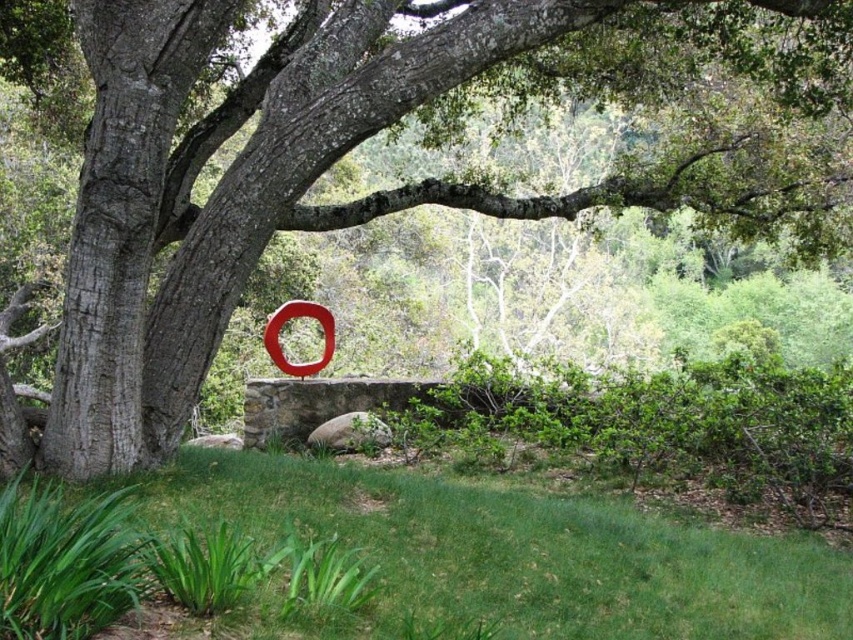
Consider the image. You are standing in the garden and want to place a small potted plant exactly at the point marked as point (437,557). According to the scene description, what will be under the potted plant when you place it there?

The green grassy at lower center is located at point (437,557), so placing the potted plant there would mean the green grassy at lower center is underneath it.

You are standing in the garden and want to place a 3.5 meter long bench between yourself and the green grassy at lower center. Can the bench fit in that space?

The distance between you and the green grassy at lower center is 3.31 meters, which is shorter than the bench length of 3.5 meters. Therefore, the bench cannot fit in that space.

You are planning to place a small garden ornament that requires a space wider than the smooth red circle at center. Based on the scene, is there a suitable location on the green grassy at lower center to accommodate this ornament?

The green grassy at lower center is wider than the smooth red circle at center, so there should be enough space to place the ornament there.